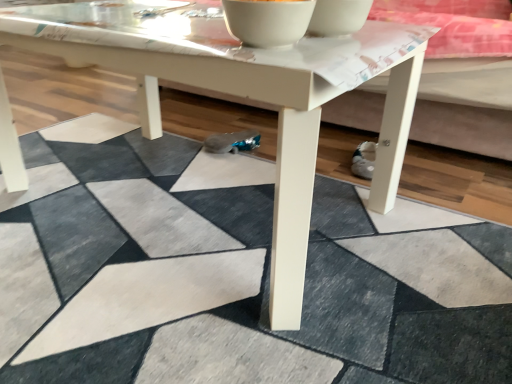
Question: From a real-world perspective, is white matte coffee table at center physically above white glossy bowl at upper center, acting as the second bowl starting from the right?

Choices:
 (A) no
 (B) yes

Answer: (A)

Question: Is white matte coffee table at center looking in the opposite direction of white glossy bowl at upper center, the first bowl from the left?

Choices:
 (A) no
 (B) yes

Answer: (A)

Question: Is white matte coffee table at center smaller than white glossy bowl at upper center, the first bowl from the left?

Choices:
 (A) no
 (B) yes

Answer: (A)

Question: Is white matte coffee table at center at the right side of white glossy bowl at upper center, acting as the second bowl starting from the right?

Choices:
 (A) no
 (B) yes

Answer: (A)

Question: From the image's perspective, would you say white matte coffee table at center is shown under white glossy bowl at upper center, acting as the second bowl starting from the right?

Choices:
 (A) no
 (B) yes

Answer: (B)

Question: Would you say white matte coffee table at center is inside or outside white glossy bowl at upper center, which ranks as the 2th bowl in left-to-right order?

Choices:
 (A) inside
 (B) outside

Answer: (B)

Question: In the image, is white matte coffee table at center positioned in front of or behind white glossy bowl at upper center, the first bowl in the right-to-left sequence?

Choices:
 (A) front
 (B) behind

Answer: (A)

Question: In terms of size, does white matte coffee table at center appear bigger or smaller than white glossy bowl at upper center, which ranks as the 2th bowl in left-to-right order?

Choices:
 (A) small
 (B) big

Answer: (B)

Question: From their relative heights in the image, would you say white matte coffee table at center is taller or shorter than white glossy bowl at upper center, which ranks as the 2th bowl in left-to-right order?

Choices:
 (A) short
 (B) tall

Answer: (B)

Question: From a real-world perspective, is white glossy bowl at upper center, the first bowl in the right-to-left sequence, positioned above or below white glossy bowl at upper center, the first bowl from the left?

Choices:
 (A) above
 (B) below

Answer: (B)

Question: In terms of size, does white glossy bowl at upper center, the first bowl in the right-to-left sequence, appear bigger or smaller than white glossy bowl at upper center, the first bowl from the left?

Choices:
 (A) small
 (B) big

Answer: (A)

Question: Would you say white glossy bowl at upper center, the first bowl in the right-to-left sequence, is to the left or to the right of white glossy bowl at upper center, acting as the second bowl starting from the right, in the picture?

Choices:
 (A) right
 (B) left

Answer: (A)

Question: Is point (323, 13) closer or farther from the camera than point (310, 6)?

Choices:
 (A) farther
 (B) closer

Answer: (A)

Question: From a real-world perspective, is white glossy bowl at upper center, the first bowl in the right-to-left sequence, above or below white matte coffee table at center?

Choices:
 (A) above
 (B) below

Answer: (A)

Question: Is white glossy bowl at upper center, which ranks as the 2th bowl in left-to-right order, situated inside white matte coffee table at center or outside?

Choices:
 (A) outside
 (B) inside

Answer: (A)